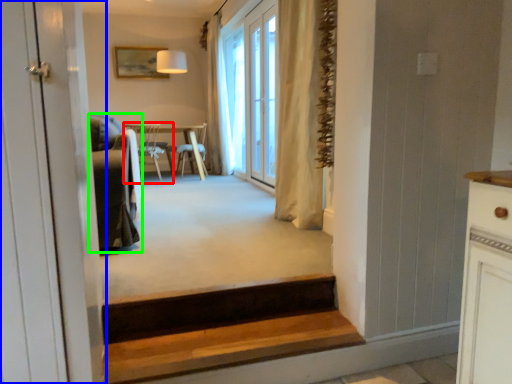
Question: Which object is positioned farthest from chair (highlighted by a red box)? Select from door (highlighted by a blue box) and armchair (highlighted by a green box).

Choices:
 (A) door
 (B) armchair

Answer: (A)